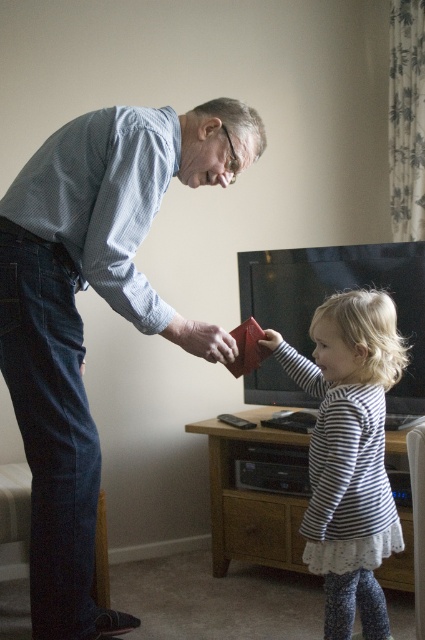
Question: Which object appears farthest from the camera in this image?

Choices:
 (A) matte red wallet at center
 (B) matte blue shirt at upper left
 (C) striped fabric dress at center

Answer: (C)

Question: Can you confirm if matte blue shirt at upper left is positioned above striped fabric dress at center?

Choices:
 (A) no
 (B) yes

Answer: (B)

Question: Is matte blue shirt at upper left smaller than striped fabric dress at center?

Choices:
 (A) yes
 (B) no

Answer: (B)

Question: Which object is the farthest from the striped fabric dress at center?

Choices:
 (A) matte blue shirt at upper left
 (B) matte red wallet at center

Answer: (A)

Question: Is striped fabric dress at center in front of matte red wallet at center?

Choices:
 (A) yes
 (B) no

Answer: (B)

Question: Which object is the closest to the striped fabric dress at center?

Choices:
 (A) matte blue shirt at upper left
 (B) matte red wallet at center

Answer: (B)